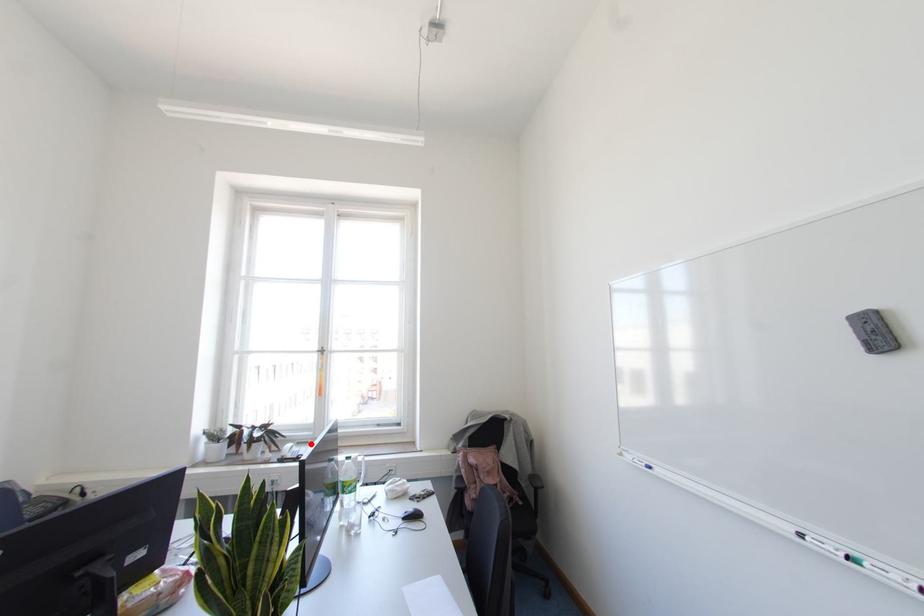
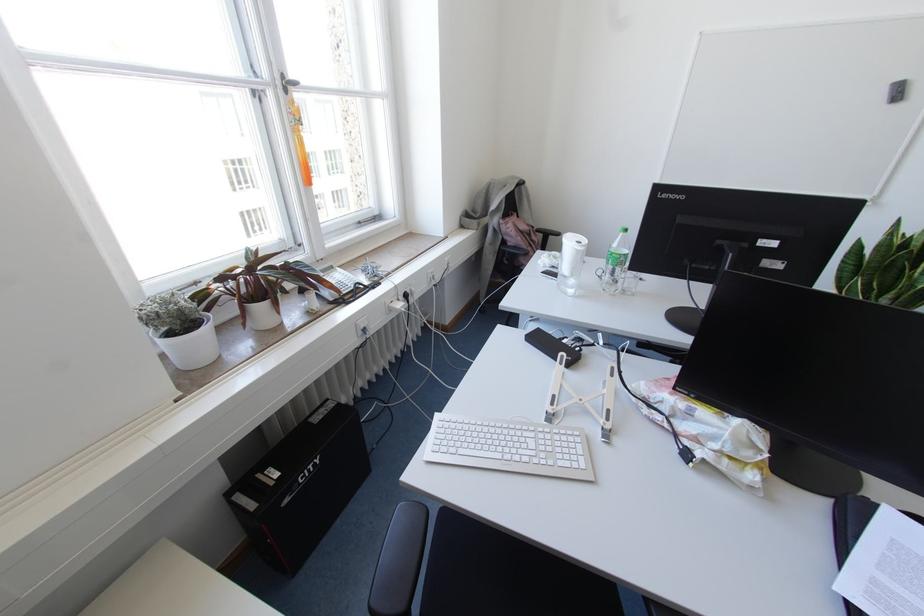
Question: I am providing you with two images of the same scene from different viewpoints. Image1 has a red point marked. In image2, the corresponding 3D location appears at what relative position? Reply with the corresponding letter.

Choices:
 (A) Closer
 (B) Farther

Answer: (A)